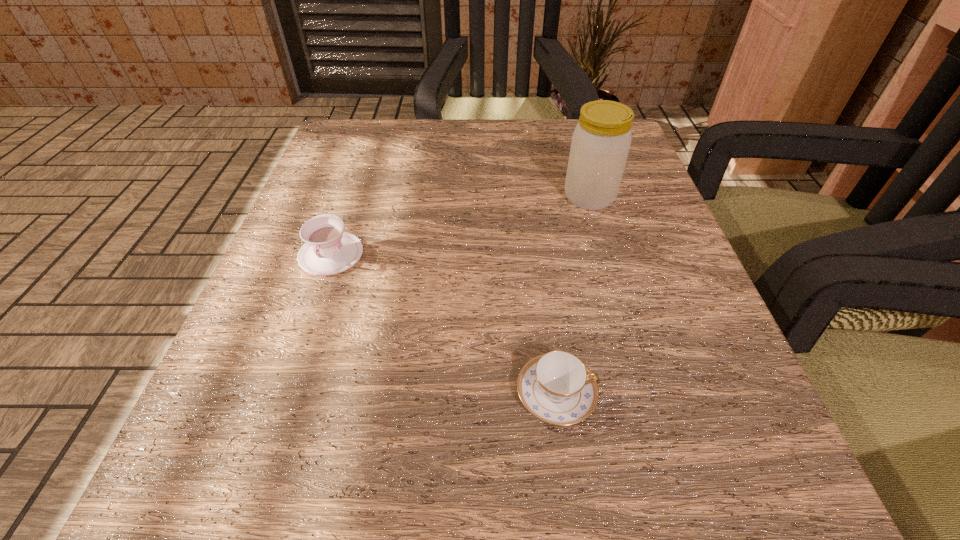
The image size is (960, 540). Identify the location of free point between the farthest object and the leftmost object. (460, 226).

You are a GUI agent. You are given a task and a screenshot of the screen. Output one action in this format:
    pyautogui.click(x=<x>, y=<y>)
    Task: Click on the free space between the second object from right to left and the tallest object
    The width and height of the screenshot is (960, 540).
    Given the screenshot: What is the action you would take?
    pyautogui.click(x=573, y=295)

The height and width of the screenshot is (540, 960). Identify the location of free space between the nearest object and the farthest object. (573, 295).

This screenshot has height=540, width=960. What are the coordinates of `free space between the right teacup and the tallest object` in the screenshot? It's located at (573, 295).

Where is `free spot between the rightmost object and the nearer teacup`? Image resolution: width=960 pixels, height=540 pixels. free spot between the rightmost object and the nearer teacup is located at coordinates (573, 295).

Locate an element on the screen. free space between the second nearest object and the farthest object is located at coordinates (460, 226).

Locate an element on the screen. This screenshot has height=540, width=960. empty space between the left teacup and the right teacup is located at coordinates (444, 324).

Locate an element on the screen. This screenshot has height=540, width=960. object that stands as the second closest to the farther teacup is located at coordinates (600, 144).

Image resolution: width=960 pixels, height=540 pixels. In order to click on the second closest object to the nearer teacup in this screenshot , I will do `click(600, 144)`.

This screenshot has height=540, width=960. In order to click on vacant space that satisfies the following two spatial constraints: 1. on the front side of the tallest object; 2. on the side with the handle of the second object from left to right in this screenshot , I will do `click(647, 394)`.